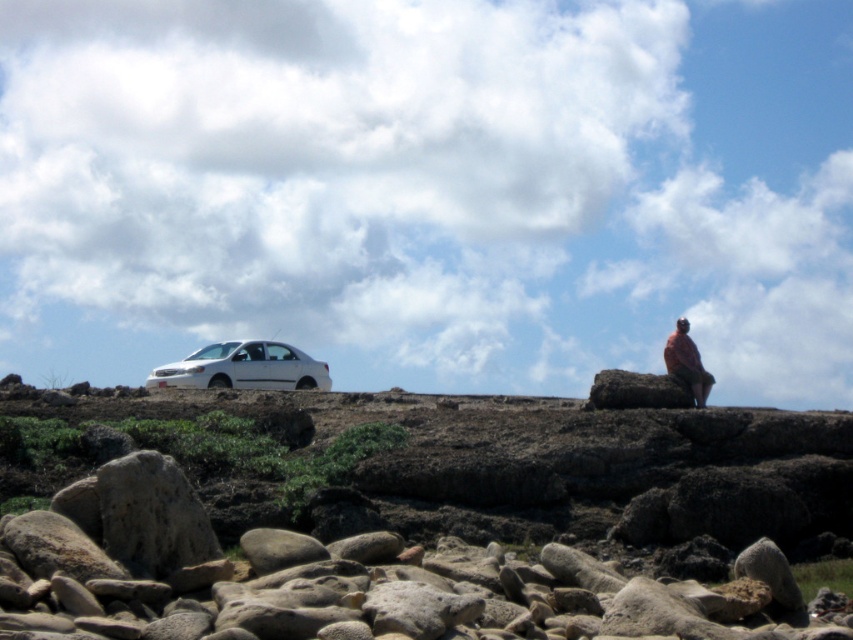
Consider the image. You are standing in the rugged outdoor scene depicted. You need to reach the white matte car at upper left. Given that you can walk 1.5 meters per second, how many seconds will it take you to reach the car?

The white matte car at upper left is 10.43 meters away from viewer. At a walking speed of 1.5 meters per second, it would take approximately 6.95 seconds to reach the car.

You are a hiker who wants to take a photo of the pink fabric at upper right without the white matte car at upper left blocking the view. Based on their positions, is this possible?

The white matte car at upper left is in front of the pink fabric at upper right, so the car is blocking the view of the pink fabric at upper right. To take a photo without the car blocking, you would need to move to a position where the car is no longer between you and the pink fabric at upper right.